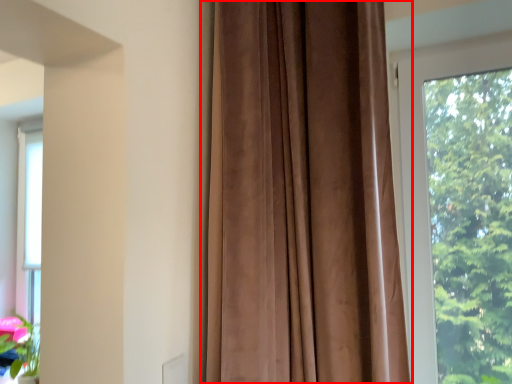
Question: Where is curtain (annotated by the red box) located in relation to window in the image?

Choices:
 (A) left
 (B) right

Answer: (A)